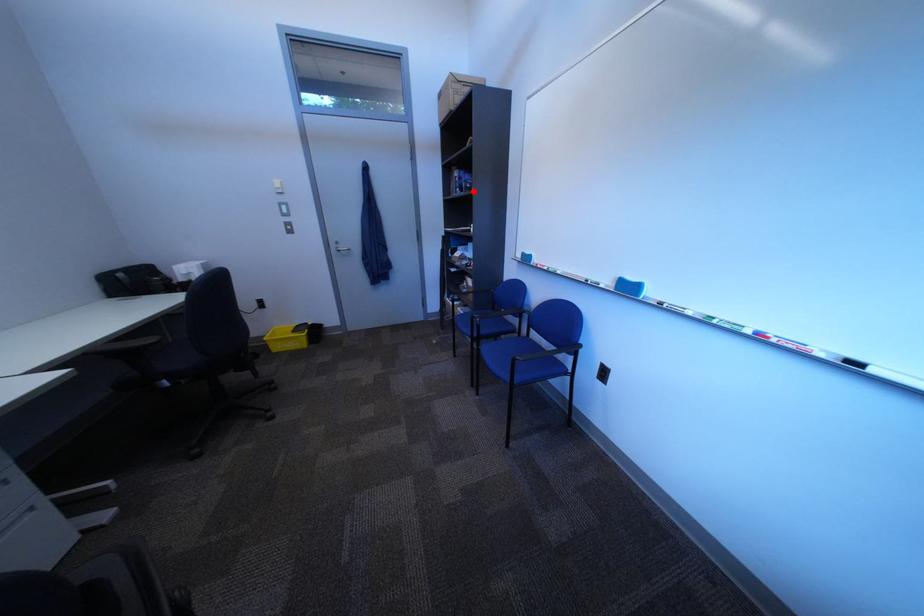
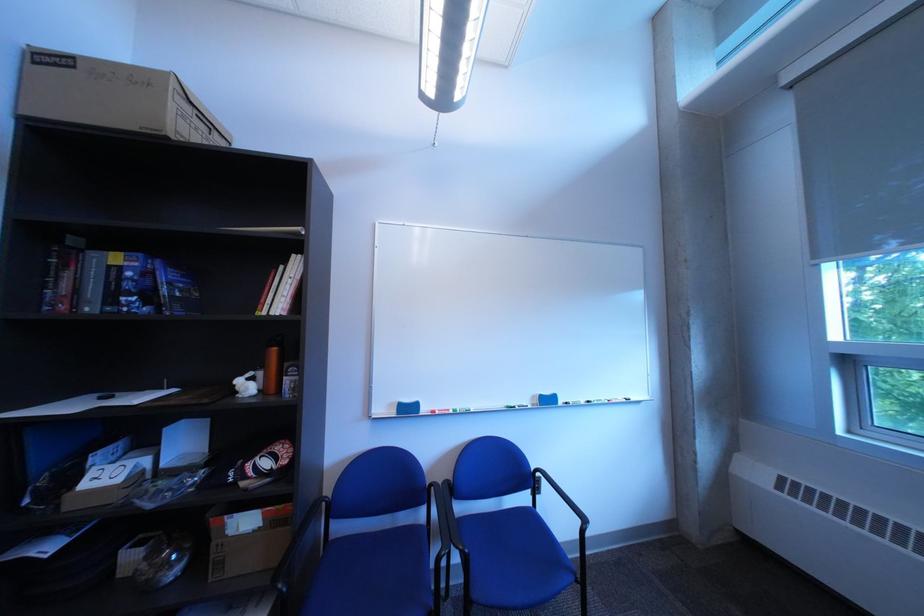
Question: I am providing you with two images of the same scene from different viewpoints. In image1, a red point is highlighted. Considering the same 3D point in image2, which of the following is correct?

Choices:
 (A) It is closer
 (B) It is farther

Answer: (B)